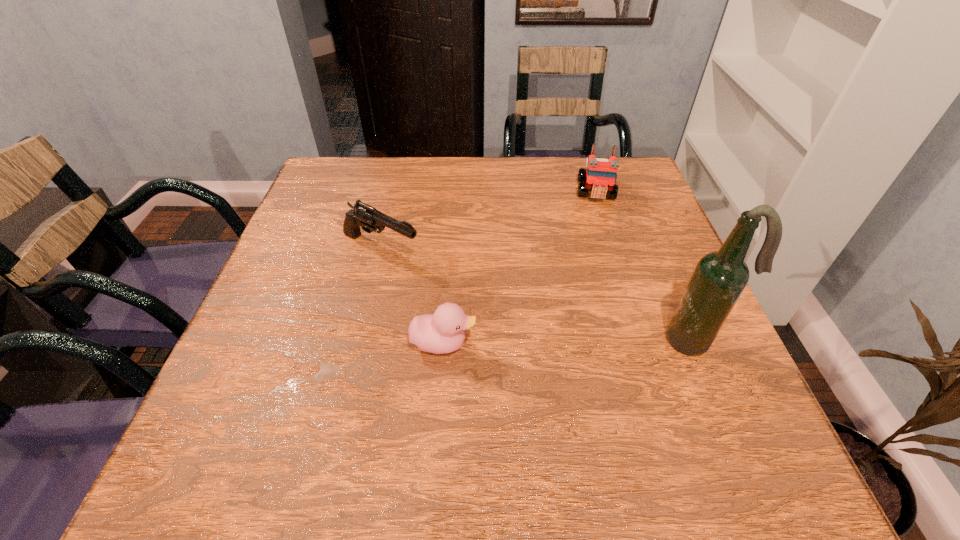
The image size is (960, 540). Find the location of `free location located 0.400m on the front-facing side of the Lego`. free location located 0.400m on the front-facing side of the Lego is located at coordinates click(603, 324).

Identify the location of vacant space located 0.190m on the front-facing side of the Lego. (599, 254).

Where is `object located in the far edge section of the desktop`? This screenshot has width=960, height=540. object located in the far edge section of the desktop is located at coordinates (599, 177).

Identify the location of object located at the left edge. (369, 218).

Where is `beer bottle located in the right edge section of the desktop`? beer bottle located in the right edge section of the desktop is located at coordinates (719, 278).

This screenshot has height=540, width=960. Find the location of `Lego that is at the right edge`. Lego that is at the right edge is located at coordinates (599, 177).

This screenshot has height=540, width=960. In order to click on object situated at the far right corner in this screenshot , I will do `click(599, 177)`.

The height and width of the screenshot is (540, 960). In the image, there is a desktop. Identify the location of vacant space at the far edge. 520,170.

Where is `free location at the left edge of the desktop`? The width and height of the screenshot is (960, 540). free location at the left edge of the desktop is located at coordinates pos(277,319).

The width and height of the screenshot is (960, 540). I want to click on blank space at the right edge of the desktop, so click(x=660, y=243).